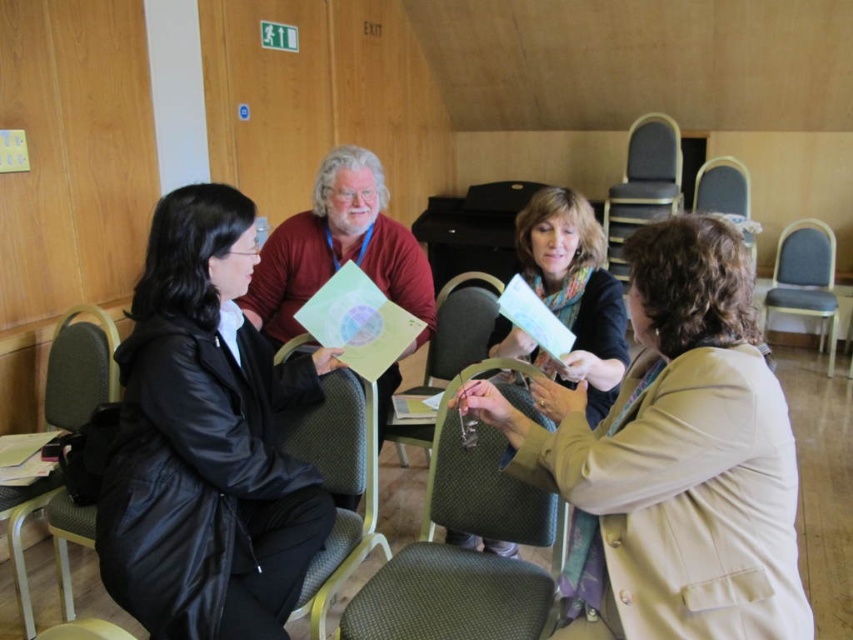
Question: Can you confirm if beige fabric jacket at center is positioned above matte beige jacket at center?

Choices:
 (A) yes
 (B) no

Answer: (B)

Question: Which point is farther to the camera?

Choices:
 (A) gray fabric chair at right
 (B) beige fabric jacket at center
 (C) gray fabric chair at lower left

Answer: (A)

Question: Is matte beige jacket at center thinner than green fabric chair at lower center?

Choices:
 (A) no
 (B) yes

Answer: (A)

Question: Does green fabric chair at center have a larger size compared to textured fabric chair at center?

Choices:
 (A) yes
 (B) no

Answer: (B)

Question: Estimate the real-world distances between objects in this image. Which object is farther from the gray fabric chair at right?

Choices:
 (A) green fabric chair at lower center
 (B) black leather jacket at left
 (C) green fabric chair at center
 (D) textured fabric chair at center

Answer: (B)

Question: Which point is farther to the camera?

Choices:
 (A) (358, 513)
 (B) (602, 356)
 (C) (640, 196)
 (D) (741, 216)

Answer: (D)